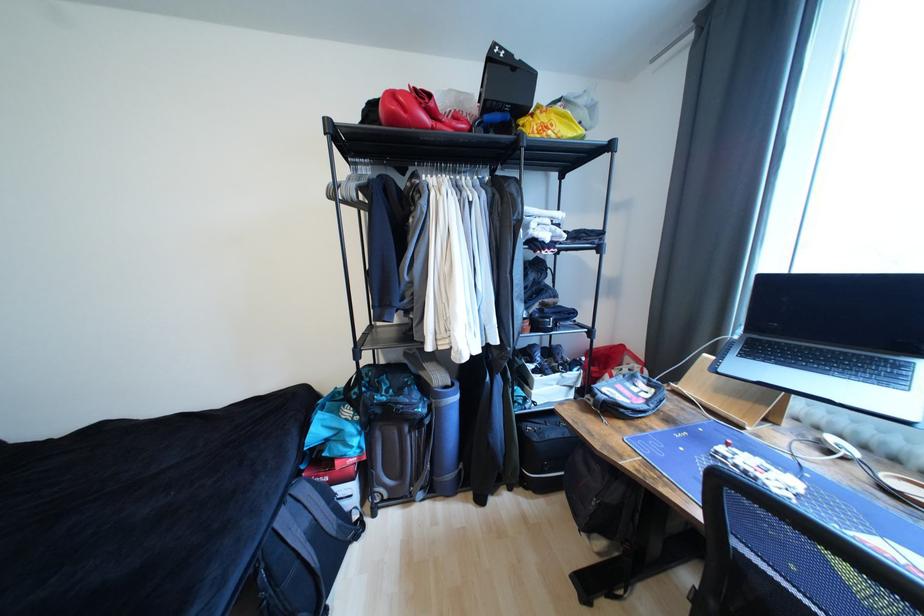
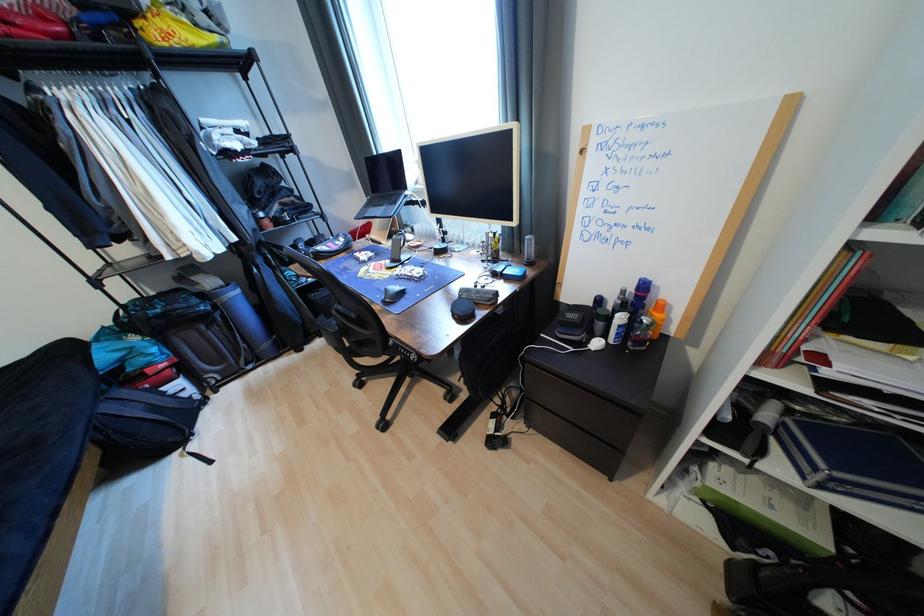
Locate, in the second image, the point that corresponds to [289,520] in the first image.

(116, 408)